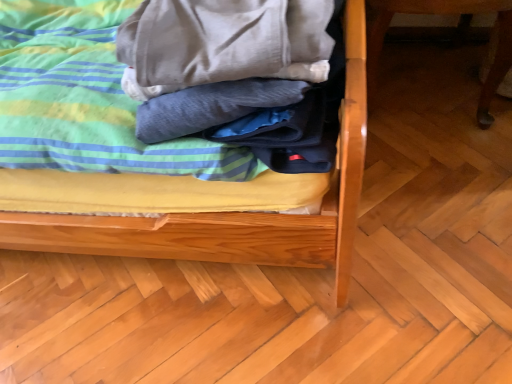
I want to click on vacant space underneath wooden table leg at right (from a real-world perspective), so click(x=424, y=81).